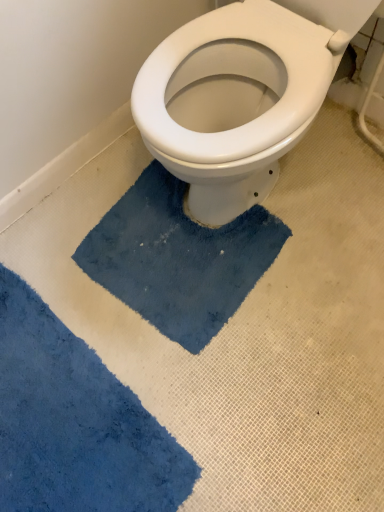
Find the location of a particular element. This screenshot has height=512, width=384. vacant area on the back side of blue soft rug at lower left, the second bath mat positioned from the top is located at coordinates (95, 252).